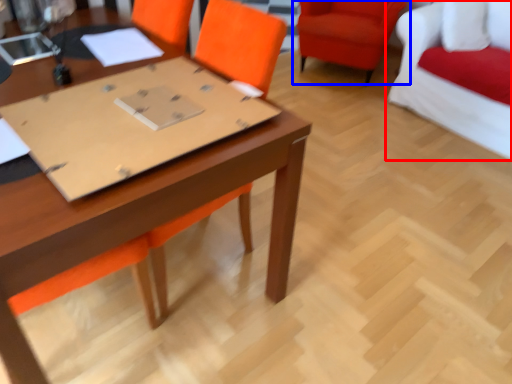
Question: Which of the following is the farthest to the observer, chair (highlighted by a red box) or chair (highlighted by a blue box)?

Choices:
 (A) chair
 (B) chair

Answer: (B)